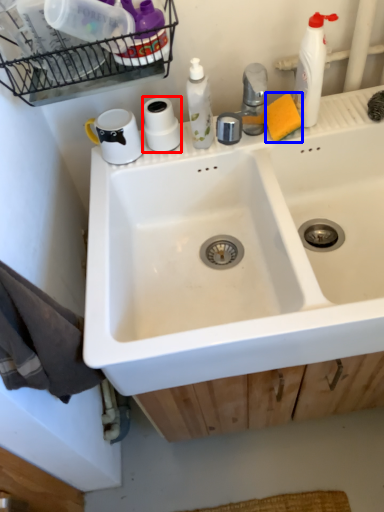
Question: Which of the following is the farthest to the observer, toilet paper (highlighted by a red box) or soap (highlighted by a blue box)?

Choices:
 (A) toilet paper
 (B) soap

Answer: (A)